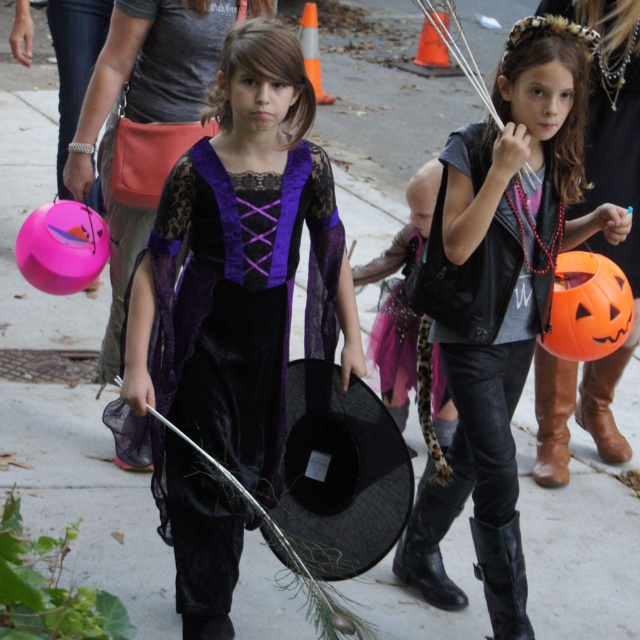
Which is above, velvet purple dress at center or matte black vest at center?

velvet purple dress at center is higher up.

Does velvet purple dress at center have a lesser height compared to matte black vest at center?

Correct, velvet purple dress at center is not as tall as matte black vest at center.

Which is behind, point (301, 173) or point (458, 314)?

The point (458, 314) is more distant.

Locate an element on the screen. velvet purple dress at center is located at coordinates (230, 312).

Which is more to the right, velvet black hat at center or orange matte pumpkin at right?

orange matte pumpkin at right is more to the right.

Is velvet black hat at center further to camera compared to orange matte pumpkin at right?

Yes, it is behind orange matte pumpkin at right.

Is point (420, 387) positioned before point (589, 292)?

No.

You are a GUI agent. You are given a task and a screenshot of the screen. Output one action in this format:
    pyautogui.click(x=<x>, y=<y>)
    Task: Click on the velvet black hat at center
    This screenshot has width=640, height=640.
    Given the screenshot: What is the action you would take?
    pyautogui.click(x=410, y=326)

Between velvet purple dress at center and velvet black hat at center, which one appears on the right side from the viewer's perspective?

Positioned to the right is velvet black hat at center.

Can you confirm if velvet purple dress at center is smaller than velvet black hat at center?

No.

Between point (262, 220) and point (381, 307), which one is positioned behind?

Point (381, 307)

Identify the location of velvet purple dress at center. Image resolution: width=640 pixels, height=640 pixels. (230, 312).